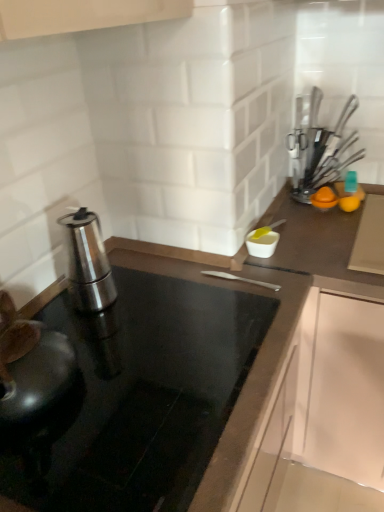
Image resolution: width=384 pixels, height=512 pixels. Find the location of `free spot in front of polished stainless steel espresso maker at left, acting as the 1th kitchen appliance starting from the bottom`. free spot in front of polished stainless steel espresso maker at left, acting as the 1th kitchen appliance starting from the bottom is located at coordinates (117, 335).